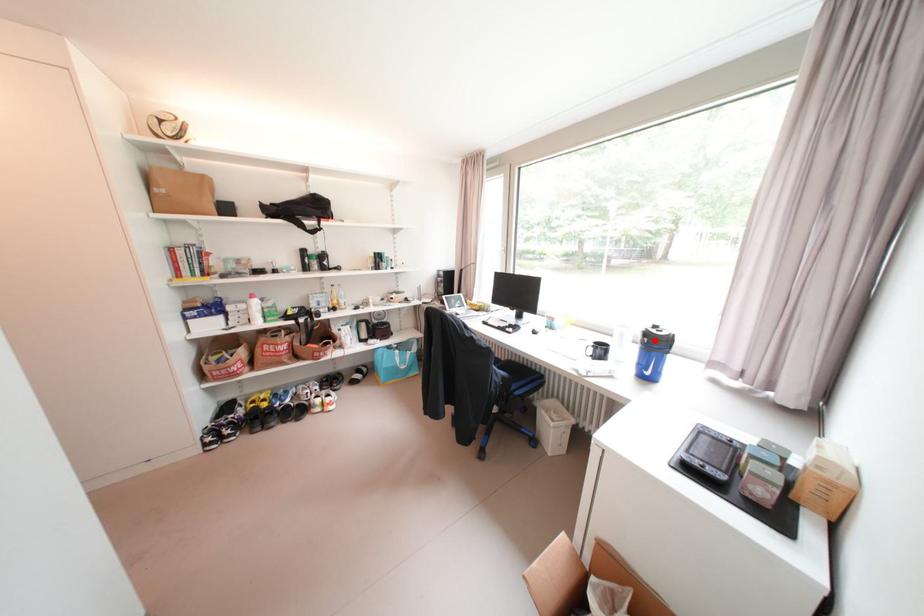
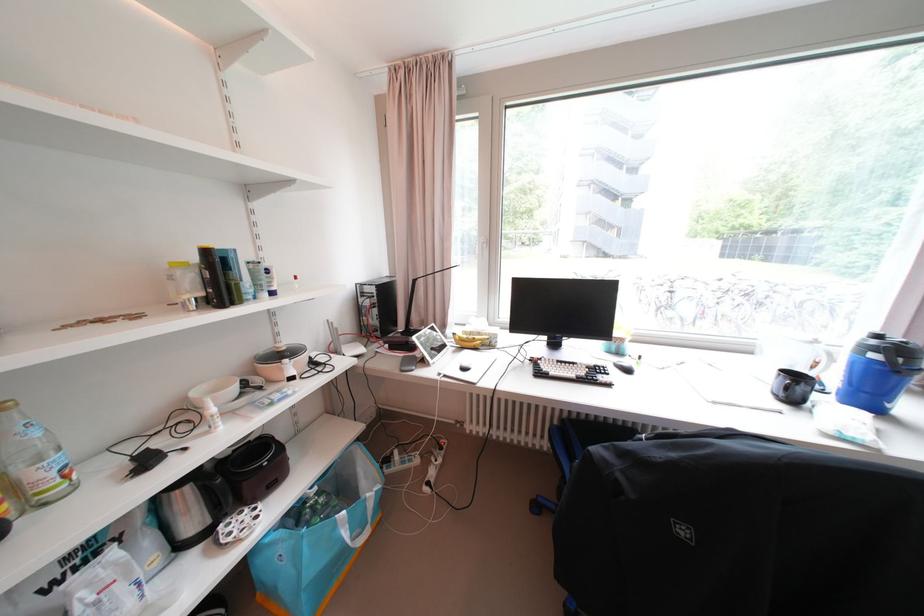
In the second image, find the point that corresponds to the highlighted location in the first image.

(909, 361)